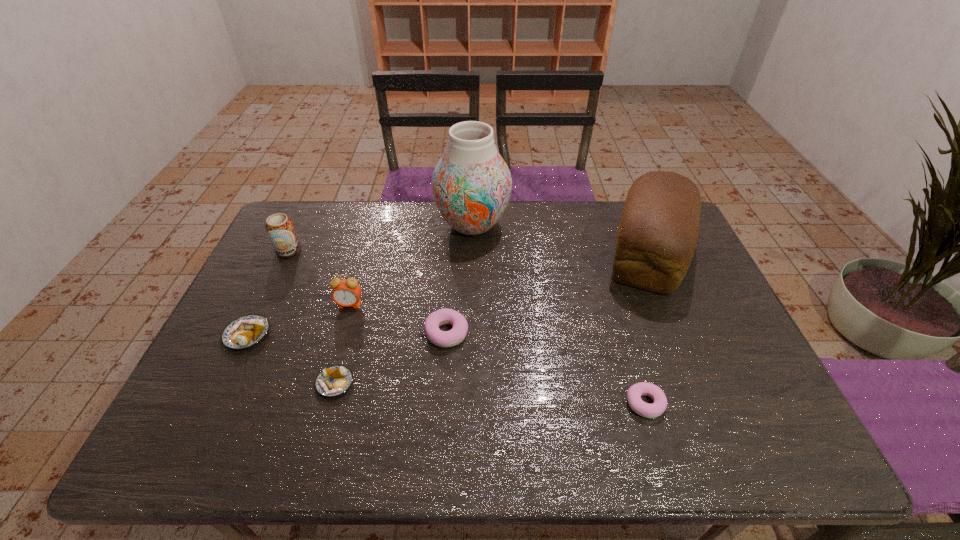
The width and height of the screenshot is (960, 540). I want to click on vacant space at the near edge of the desktop, so (x=387, y=458).

Image resolution: width=960 pixels, height=540 pixels. What are the coordinates of `free space at the left edge of the desktop` in the screenshot? It's located at (257, 268).

Find the location of a particular element. free space at the far left corner of the desktop is located at coordinates (321, 221).

You are a GUI agent. You are given a task and a screenshot of the screen. Output one action in this format:
    pyautogui.click(x=<x>, y=<y>)
    Task: Click on the vacant space that is in between the tallest object and the right pink pastry
    Image resolution: width=960 pixels, height=540 pixels.
    Given the screenshot: What is the action you would take?
    pyautogui.click(x=559, y=314)

Find the location of a particular element. Image resolution: width=960 pixels, height=540 pixels. free space that is in between the tallest object and the left pink pastry is located at coordinates (460, 279).

Identify the location of empty location between the left brown pastry and the nearer pink pastry. This screenshot has height=540, width=960. (446, 369).

Identify the location of unoccupied area between the leftmost pastry and the bread. This screenshot has width=960, height=540. (448, 295).

Locate an element on the screen. The image size is (960, 540). free spot between the beer can and the leftmost pastry is located at coordinates (268, 293).

At what (x,y) coordinates should I click in order to perform the action: click on free space between the second tallest object and the pink alarm clock. Please return your answer as a coordinate pair (x, y). The image size is (960, 540). Looking at the image, I should click on (499, 280).

At what (x,y) coordinates should I click in order to perform the action: click on free space between the brown bread and the tallest object. Please return your answer as a coordinate pair (x, y). Image resolution: width=960 pixels, height=540 pixels. Looking at the image, I should click on (561, 240).